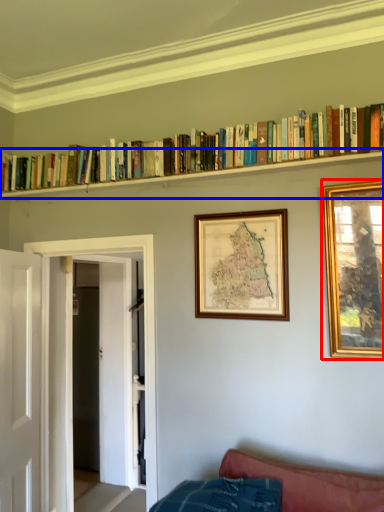
Question: Which of the following is the farthest to the observer, picture frame (highlighted by a red box) or shelf (highlighted by a blue box)?

Choices:
 (A) picture frame
 (B) shelf

Answer: (B)